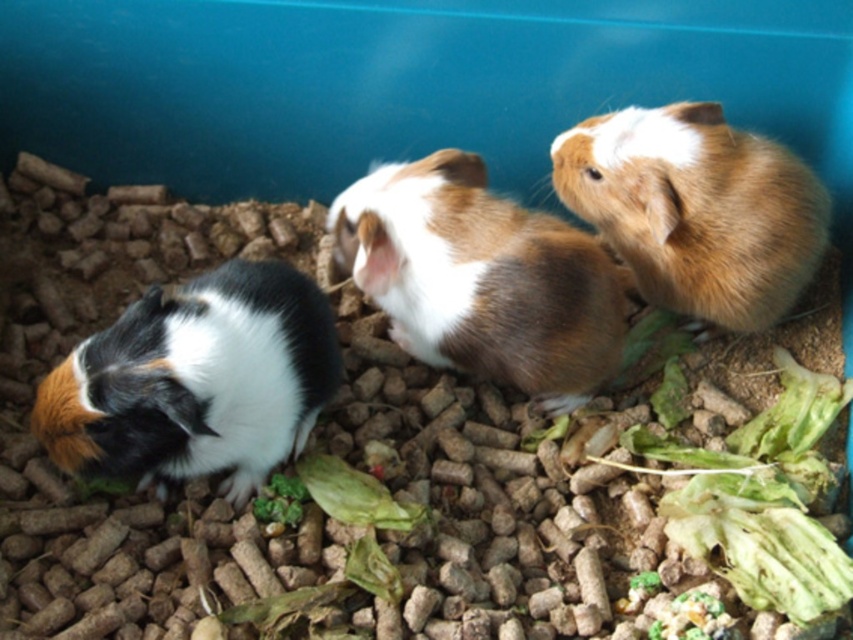
Question: Which point appears closest to the camera in this image?

Choices:
 (A) pos(45,429)
 (B) pos(605,180)

Answer: (A)

Question: Does black and white fur hamster at left have a larger size compared to brown furry hamster at upper right?

Choices:
 (A) yes
 (B) no

Answer: (A)

Question: Which point appears closest to the camera in this image?

Choices:
 (A) (70, 362)
 (B) (606, 328)
 (C) (749, 234)

Answer: (A)

Question: Is black and white fur hamster at left to the left of brown fuzzy hamster at center from the viewer's perspective?

Choices:
 (A) yes
 (B) no

Answer: (A)

Question: Which object appears farthest from the camera in this image?

Choices:
 (A) brown fuzzy hamster at center
 (B) brown furry hamster at upper right

Answer: (B)

Question: Is the position of black and white fur hamster at left more distant than that of brown fuzzy hamster at center?

Choices:
 (A) no
 (B) yes

Answer: (A)